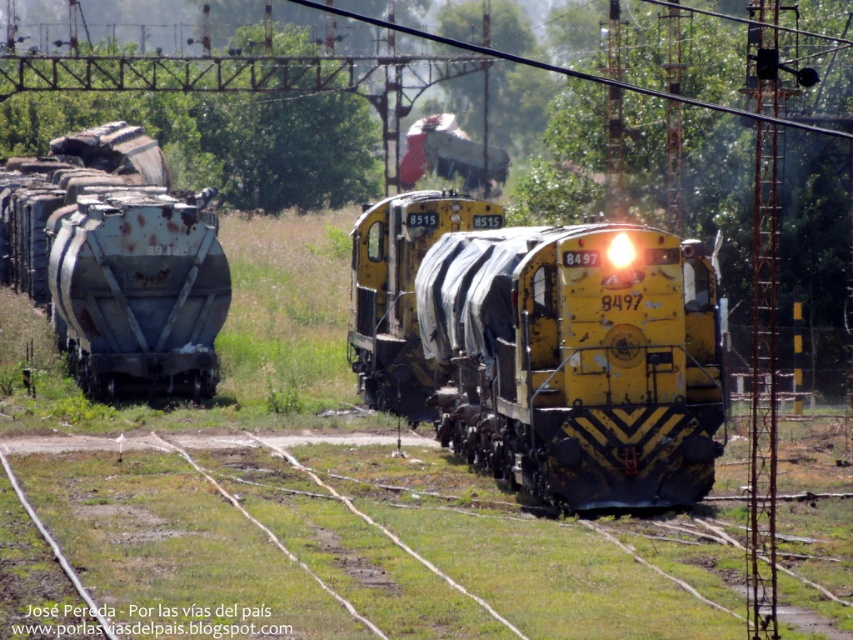
You are a railway inspector checking the tracks between the yellow matte train at center and the rusty metal tank car at left. The track can only handle vehicles narrower than 3 meters. Can both vehicles pass through safely?

The yellow matte train at center is narrower than the rusty metal tank car at left. Since the track can only handle vehicles narrower than 3 meters, we need to know both widths. However, the description only states the yellow train is narrower, but not their exact widths. Without knowing if the rusty tank car is under 3 meters, we can only confirm the yellow train can pass, but the rusty one might be too wide.

You are a railway inspector checking the alignment of the tracks. You notice the yellow matte train at center and the rusty metal tank car at left. Which one is positioned lower in the image?

The yellow matte train at center is located below the rusty metal tank car at left, so it is positioned lower in the image.